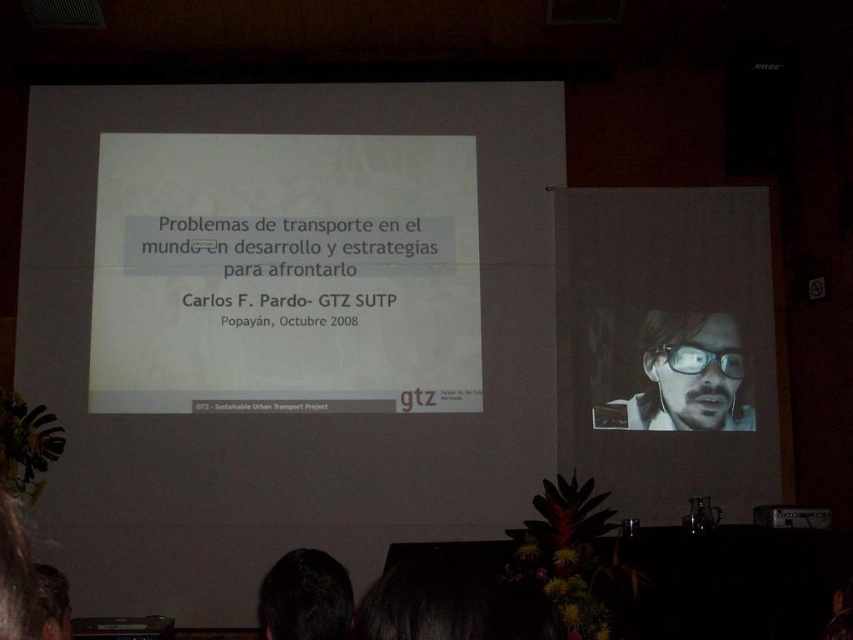
Which is behind, point (634, 323) or point (306, 564)?

The point (634, 323) is behind.

Which of these two, matte white screen at right or dark brown hair at lower center, stands shorter?

dark brown hair at lower center is shorter.

Find the location of a particular element. Image resolution: width=853 pixels, height=640 pixels. matte white screen at right is located at coordinates (666, 346).

Who is positioned more to the left, matte white screen at right or matte black glasses at upper right?

Positioned to the left is matte white screen at right.

Does matte white screen at right have a smaller size compared to matte black glasses at upper right?

No, matte white screen at right is not smaller than matte black glasses at upper right.

Is point (585, 340) closer to viewer compared to point (743, 410)?

No, (585, 340) is further to viewer.

The height and width of the screenshot is (640, 853). I want to click on matte white screen at right, so click(x=666, y=346).

Does matte black glasses at upper right have a lesser width compared to dark brown hair at lower center?

In fact, matte black glasses at upper right might be wider than dark brown hair at lower center.

Is point (677, 340) farther from camera compared to point (340, 566)?

Yes, it is behind point (340, 566).

Does point (653, 378) lie behind point (289, 637)?

That is True.

The width and height of the screenshot is (853, 640). Identify the location of matte black glasses at upper right. (689, 374).